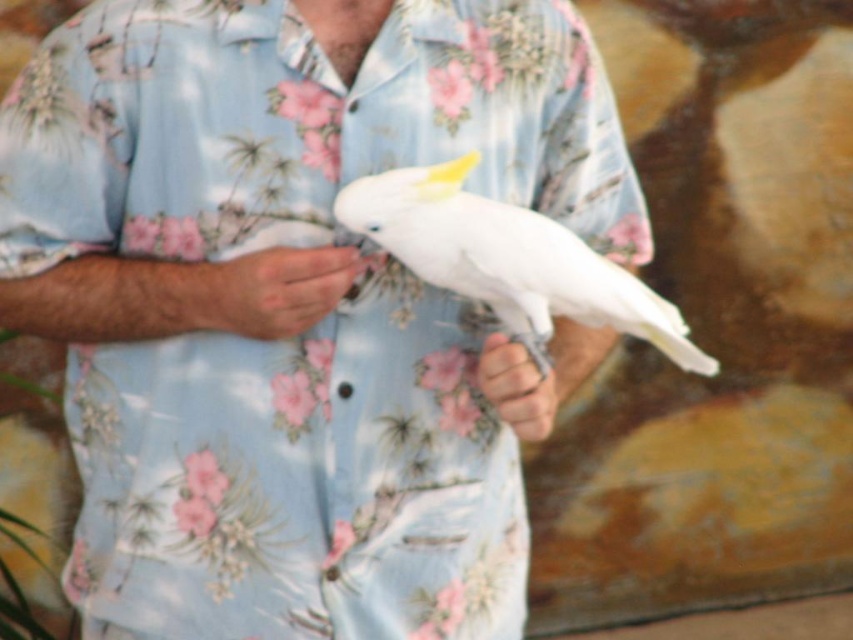
Question: Is matte blue shirt at center further to camera compared to white feathered bird at center?

Choices:
 (A) no
 (B) yes

Answer: (B)

Question: Estimate the real-world distances between objects in this image. Which object is closer to the white feathered bird at center?

Choices:
 (A) smooth skin hand at center
 (B) white feathered parrot at center

Answer: (A)

Question: Which point is farther to the camera?

Choices:
 (A) (489, 397)
 (B) (599, 333)
 (C) (354, 253)
 (D) (305, 259)

Answer: (B)

Question: Observing the image, what is the correct spatial positioning of matte blue shirt at center in reference to white feathered bird at center?

Choices:
 (A) right
 (B) left

Answer: (B)

Question: Which of the following is the closest to the observer?

Choices:
 (A) white matte hand at center
 (B) matte blue shirt at center

Answer: (B)

Question: Is white feathered bird at center above smooth skin hand at center?

Choices:
 (A) yes
 (B) no

Answer: (A)